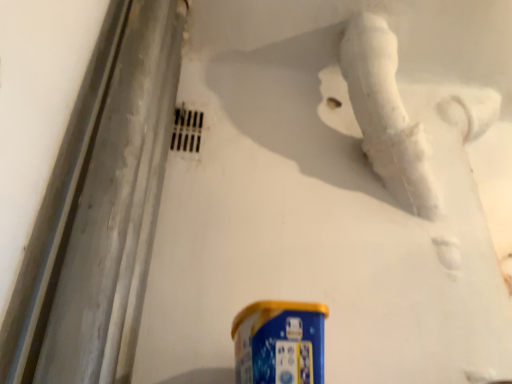
Find the location of a particular element. blue metallic spray can at bottom is located at coordinates (280, 343).

What do you see at coordinates (280, 343) in the screenshot?
I see `blue metallic spray can at bottom` at bounding box center [280, 343].

From the picture: What is the approximate width of white marble water pipe at upper right?

white marble water pipe at upper right is 9.72 inches in width.

This screenshot has width=512, height=384. Describe the element at coordinates (387, 115) in the screenshot. I see `white marble water pipe at upper right` at that location.

Locate an element on the screen. white marble water pipe at upper right is located at coordinates (387, 115).

In order to face white marble water pipe at upper right, should I rotate leftwards or rightwards?

A 18.756 degree turn to the right will do.

What is the approximate height of white marble water pipe at upper right?

white marble water pipe at upper right is 19.67 inches in height.

Find the location of a particular element. This screenshot has width=512, height=384. blue metallic spray can at bottom is located at coordinates (280, 343).

Is blue metallic spray can at bottom at the left side of white marble water pipe at upper right?

Yes, blue metallic spray can at bottom is to the left of white marble water pipe at upper right.

In the image, is blue metallic spray can at bottom positioned in front of or behind white marble water pipe at upper right?

blue metallic spray can at bottom is in front of white marble water pipe at upper right.

Is point (317, 320) closer or farther from the camera than point (377, 160)?

Point (317, 320) is closer to the camera than point (377, 160).

From the image's perspective, is blue metallic spray can at bottom below white marble water pipe at upper right?

Yes, from the image's perspective, blue metallic spray can at bottom is below white marble water pipe at upper right.

In the scene shown: From a real-world perspective, which object stands above the other?

white marble water pipe at upper right, from a real-world perspective.

Based on the photo, which object is wider, blue metallic spray can at bottom or white marble water pipe at upper right?

blue metallic spray can at bottom.

Considering the sizes of blue metallic spray can at bottom and white marble water pipe at upper right in the image, is blue metallic spray can at bottom taller or shorter than white marble water pipe at upper right?

In the image, blue metallic spray can at bottom appears to be shorter than white marble water pipe at upper right.

Is blue metallic spray can at bottom bigger than white marble water pipe at upper right?

Incorrect, blue metallic spray can at bottom is not larger than white marble water pipe at upper right.

Is blue metallic spray can at bottom spatially inside white marble water pipe at upper right, or outside of it?

blue metallic spray can at bottom is located beyond the bounds of white marble water pipe at upper right.

Based on the photo, is blue metallic spray can at bottom far from white marble water pipe at upper right?

No.

Is blue metallic spray can at bottom oriented towards white marble water pipe at upper right?

No.

What's the angular difference between blue metallic spray can at bottom and white marble water pipe at upper right's facing directions?

They differ by 0.208 degrees in their facing directions.

At what (x,y) coordinates should I click in order to perform the action: click on water pipe behind the blue metallic spray can at bottom. Please return your answer as a coordinate pair (x, y). This screenshot has width=512, height=384. Looking at the image, I should click on (387, 115).

Is white marble water pipe at upper right to the left or to the right of blue metallic spray can at bottom in the image?

Clearly, white marble water pipe at upper right is on the right of blue metallic spray can at bottom in the image.

Is white marble water pipe at upper right positioned before blue metallic spray can at bottom?

That is False.

Which is in front, point (429, 183) or point (240, 374)?

The point (240, 374) is closer.

Looking at this image, from the image's perspective, which one is positioned higher, white marble water pipe at upper right or blue metallic spray can at bottom?

white marble water pipe at upper right appears higher in the image.

From a real-world perspective, who is located higher, white marble water pipe at upper right or blue metallic spray can at bottom?

In real-world perspective, white marble water pipe at upper right is above.

In the scene shown: Considering the relative sizes of white marble water pipe at upper right and blue metallic spray can at bottom in the image provided, is white marble water pipe at upper right wider than blue metallic spray can at bottom?

No, white marble water pipe at upper right is not wider than blue metallic spray can at bottom.

From their relative heights in the image, would you say white marble water pipe at upper right is taller or shorter than blue metallic spray can at bottom?

In the image, white marble water pipe at upper right appears to be taller than blue metallic spray can at bottom.

Considering the relative sizes of white marble water pipe at upper right and blue metallic spray can at bottom in the image provided, is white marble water pipe at upper right smaller than blue metallic spray can at bottom?

Actually, white marble water pipe at upper right might be larger than blue metallic spray can at bottom.

Is white marble water pipe at upper right inside the boundaries of blue metallic spray can at bottom, or outside?

white marble water pipe at upper right lies outside blue metallic spray can at bottom.

Is white marble water pipe at upper right next to blue metallic spray can at bottom?

white marble water pipe at upper right is not next to blue metallic spray can at bottom, and they're not touching.

Is white marble water pipe at upper right oriented towards blue metallic spray can at bottom?

No, white marble water pipe at upper right is not oriented towards blue metallic spray can at bottom.

How different are the orientations of white marble water pipe at upper right and blue metallic spray can at bottom in degrees?

The angle between the facing direction of white marble water pipe at upper right and the facing direction of blue metallic spray can at bottom is 0.208 degrees.

Identify the location of water pipe behind the blue metallic spray can at bottom. (387, 115).

This screenshot has width=512, height=384. Identify the location of water pipe that appears behind the blue metallic spray can at bottom. (387, 115).

In the image, there is a blue metallic spray can at bottom. Where is `water pipe above it (from the image's perspective)`? water pipe above it (from the image's perspective) is located at coordinates (387, 115).